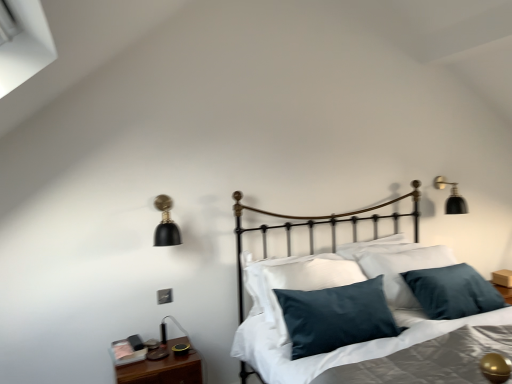
This screenshot has height=384, width=512. What do you see at coordinates (336, 316) in the screenshot?
I see `velvet dark blue pillow at center, the first pillow when ordered from front to back` at bounding box center [336, 316].

How much space does velvet dark blue pillow at center, which is the 2th pillow in back-to-front order, occupy vertically?

velvet dark blue pillow at center, which is the 2th pillow in back-to-front order, is 22.36 inches tall.

What do you see at coordinates (452, 197) in the screenshot? Image resolution: width=512 pixels, height=384 pixels. I see `black matte wall sconce at upper right, acting as the first lamp starting from the right` at bounding box center [452, 197].

What do you see at coordinates (166, 224) in the screenshot? The width and height of the screenshot is (512, 384). I see `black matte lamp at left, the first lamp in the left-to-right sequence` at bounding box center [166, 224].

Image resolution: width=512 pixels, height=384 pixels. I want to click on velvet dark blue pillow at center, which is the 2th pillow in back-to-front order, so click(x=336, y=316).

From a real-world perspective, which is physically below, velvety dark blue pillow at center, which appears as the first pillow when viewed from the back, or wooden nightstand at lower left?

In real-world perspective, wooden nightstand at lower left is lower.

Is velvety dark blue pillow at center, which ranks as the second pillow in front-to-back order, not inside wooden nightstand at lower left?

Yes.

Which object is positioned more to the left, velvety dark blue pillow at center, which appears as the first pillow when viewed from the back, or wooden nightstand at lower left?

wooden nightstand at lower left is more to the left.

Is wooden nightstand at lower left positioned beyond the bounds of black matte wall sconce at upper right, which is counted as the 2th lamp, starting from the front?

Yes, wooden nightstand at lower left is located beyond the bounds of black matte wall sconce at upper right, which is counted as the 2th lamp, starting from the front.

Would you consider wooden nightstand at lower left to be distant from black matte wall sconce at upper right, acting as the second lamp starting from the left?

Yes.

From a real-world perspective, is wooden nightstand at lower left above or below black matte wall sconce at upper right, acting as the first lamp starting from the right?

wooden nightstand at lower left is below black matte wall sconce at upper right, acting as the first lamp starting from the right.

From their relative heights in the image, would you say wooden nightstand at lower left is taller or shorter than black matte wall sconce at upper right, which is counted as the 2th lamp, starting from the front?

wooden nightstand at lower left is shorter than black matte wall sconce at upper right, which is counted as the 2th lamp, starting from the front.

From the image's perspective, which pillow is the 2nd one below the black matte wall sconce at upper right, which ranks as the 1th lamp in back-to-front order? Please provide its 2D coordinates.

[(336, 316)]

Is black matte wall sconce at upper right, acting as the first lamp starting from the right, to the left of velvet dark blue pillow at center, the first pillow when ordered from front to back, from the viewer's perspective?

No, black matte wall sconce at upper right, acting as the first lamp starting from the right, is not to the left of velvet dark blue pillow at center, the first pillow when ordered from front to back.

Can you confirm if black matte wall sconce at upper right, which ranks as the 1th lamp in back-to-front order, is wider than velvet dark blue pillow at center, the first pillow when ordered from front to back?

No, black matte wall sconce at upper right, which ranks as the 1th lamp in back-to-front order, is not wider than velvet dark blue pillow at center, the first pillow when ordered from front to back.

Is black matte wall sconce at upper right, acting as the first lamp starting from the right, positioned with its back to velvet dark blue pillow at center, which is the 2th pillow in back-to-front order?

No, black matte wall sconce at upper right, acting as the first lamp starting from the right, is not facing the opposite direction of velvet dark blue pillow at center, which is the 2th pillow in back-to-front order.

From the image's perspective, is wooden nightstand at lower left positioned above or below velvet dark blue pillow at center, the first pillow when ordered from front to back?

From the image's perspective, wooden nightstand at lower left appears below velvet dark blue pillow at center, the first pillow when ordered from front to back.

Is wooden nightstand at lower left inside or outside of velvet dark blue pillow at center, which is the 2th pillow in back-to-front order?

The correct answer is: outside.

Looking at their sizes, would you say wooden nightstand at lower left is wider or thinner than velvet dark blue pillow at center, the first pillow when ordered from front to back?

Clearly, wooden nightstand at lower left has more width compared to velvet dark blue pillow at center, the first pillow when ordered from front to back.

Can you see wooden nightstand at lower left touching velvet dark blue pillow at center, which is the 2th pillow in back-to-front order?

wooden nightstand at lower left is not next to velvet dark blue pillow at center, which is the 2th pillow in back-to-front order, and they're not touching.

What are the coordinates of `nightstand in front of the velvety dark blue pillow at center, which appears as the first pillow when viewed from the back` in the screenshot? It's located at (163, 368).

Considering the positions of objects wooden nightstand at lower left and velvety dark blue pillow at center, which appears as the first pillow when viewed from the back, in the image provided, who is more to the left, wooden nightstand at lower left or velvety dark blue pillow at center, which appears as the first pillow when viewed from the back,?

From the viewer's perspective, wooden nightstand at lower left appears more on the left side.

In terms of height, does wooden nightstand at lower left look taller or shorter compared to velvety dark blue pillow at center, which ranks as the second pillow in front-to-back order?

Clearly, wooden nightstand at lower left is shorter compared to velvety dark blue pillow at center, which ranks as the second pillow in front-to-back order.

In terms of size, does black matte wall sconce at upper right, acting as the second lamp starting from the left, appear bigger or smaller than black matte lamp at left, which is the second lamp in back-to-front order?

black matte wall sconce at upper right, acting as the second lamp starting from the left, is smaller than black matte lamp at left, which is the second lamp in back-to-front order.

Considering the positions of points (457, 207) and (163, 215), is point (457, 207) closer to camera compared to point (163, 215)?

No, (457, 207) is behind (163, 215).

From the image's perspective, is black matte wall sconce at upper right, acting as the second lamp starting from the left, located above black matte lamp at left, the 1th lamp viewed from the front?

Yes, from the image's perspective, black matte wall sconce at upper right, acting as the second lamp starting from the left, is above black matte lamp at left, the 1th lamp viewed from the front.

Considering the relative sizes of velvet dark blue pillow at center, the first pillow when ordered from front to back, and wooden nightstand at lower left in the image provided, is velvet dark blue pillow at center, the first pillow when ordered from front to back, taller than wooden nightstand at lower left?

Indeed, velvet dark blue pillow at center, the first pillow when ordered from front to back, has a greater height compared to wooden nightstand at lower left.

Considering their positions, is velvet dark blue pillow at center, which is the 2th pillow in back-to-front order, located in front of or behind wooden nightstand at lower left?

Visually, velvet dark blue pillow at center, which is the 2th pillow in back-to-front order, is located in front of wooden nightstand at lower left.

Based on their sizes in the image, would you say velvet dark blue pillow at center, which is the 2th pillow in back-to-front order, is bigger or smaller than wooden nightstand at lower left?

Considering their sizes, velvet dark blue pillow at center, which is the 2th pillow in back-to-front order, takes up more space than wooden nightstand at lower left.

Is velvet dark blue pillow at center, the first pillow when ordered from front to back, far from wooden nightstand at lower left?

No, velvet dark blue pillow at center, the first pillow when ordered from front to back, is not far from wooden nightstand at lower left.

From the wooden nightstand at lower left, count 1st pillow to the right and point to it. Please provide its 2D coordinates.

[(296, 282)]

You are a GUI agent. You are given a task and a screenshot of the screen. Output one action in this format:
    pyautogui.click(x=<x>, y=<y>)
    Task: Click on the nightstand below the black matte wall sconce at upper right, which ranks as the 1th lamp in back-to-front order (from a real-world perspective)
    This screenshot has height=384, width=512.
    Given the screenshot: What is the action you would take?
    [x=163, y=368]

Looking at the image, which one is located closer to silky gray sheet at center, velvety dark blue pillow at center, which ranks as the second pillow in front-to-back order, or black matte wall sconce at upper right, which is counted as the 2th lamp, starting from the front?

Based on the image, velvety dark blue pillow at center, which ranks as the second pillow in front-to-back order, appears to be nearer to silky gray sheet at center.

Looking at the image, which one is located further to silky gray sheet at center, black matte lamp at left, placed as the second lamp when sorted from right to left, or wooden nightstand at lower left?

Based on the image, black matte lamp at left, placed as the second lamp when sorted from right to left, appears to be further to silky gray sheet at center.

Estimate the real-world distances between objects in this image. Which object is closer to black matte lamp at left, which is the second lamp in back-to-front order, silky gray sheet at center or velvet dark blue pillow at center, which is the 2th pillow in back-to-front order?

Among the two, silky gray sheet at center is located nearer to black matte lamp at left, which is the second lamp in back-to-front order.

In the scene shown: From the image, which object appears to be nearer to black matte wall sconce at upper right, acting as the second lamp starting from the left, velvety dark blue pillow at center, which appears as the first pillow when viewed from the back, or wooden nightstand at lower left?

velvety dark blue pillow at center, which appears as the first pillow when viewed from the back.

When comparing their distances from wooden nightstand at lower left, does black matte lamp at left, which is the second lamp in back-to-front order, or silky gray sheet at center seem further?

black matte lamp at left, which is the second lamp in back-to-front order, lies further to wooden nightstand at lower left than the other object.

Estimate the real-world distances between objects in this image. Which object is further from black matte wall sconce at upper right, acting as the second lamp starting from the left, velvet dark blue pillow at center, the first pillow when ordered from front to back, or velvety dark blue pillow at center, which ranks as the second pillow in front-to-back order?

velvet dark blue pillow at center, the first pillow when ordered from front to back, is positioned further to the anchor black matte wall sconce at upper right, acting as the second lamp starting from the left.

From the image, which object appears to be nearer to black matte wall sconce at upper right, which ranks as the 1th lamp in back-to-front order, black matte lamp at left, the 1th lamp viewed from the front, or wooden nightstand at lower left?

black matte lamp at left, the 1th lamp viewed from the front.

Which object lies nearer to the anchor point black matte lamp at left, the 1th lamp viewed from the front, wooden nightstand at lower left or black matte wall sconce at upper right, acting as the first lamp starting from the right?

wooden nightstand at lower left lies closer to black matte lamp at left, the 1th lamp viewed from the front, than the other object.

Locate an element on the screen. nightstand between black matte lamp at left, placed as the second lamp when sorted from right to left, and silky gray sheet at center, in the horizontal direction is located at coordinates (163, 368).

Locate an element on the screen. This screenshot has height=384, width=512. pillow between wooden nightstand at lower left and velvet dark blue pillow at center, which is the 2th pillow in back-to-front order, in the horizontal direction is located at coordinates (296, 282).

The width and height of the screenshot is (512, 384). Find the location of `sheet situated between wooden nightstand at lower left and black matte wall sconce at upper right, which is counted as the 2th lamp, starting from the front, from left to right`. sheet situated between wooden nightstand at lower left and black matte wall sconce at upper right, which is counted as the 2th lamp, starting from the front, from left to right is located at coordinates (338, 348).

What are the coordinates of `nightstand between black matte lamp at left, placed as the second lamp when sorted from right to left, and velvet dark blue pillow at center, which is the 2th pillow in back-to-front order` in the screenshot? It's located at (163, 368).